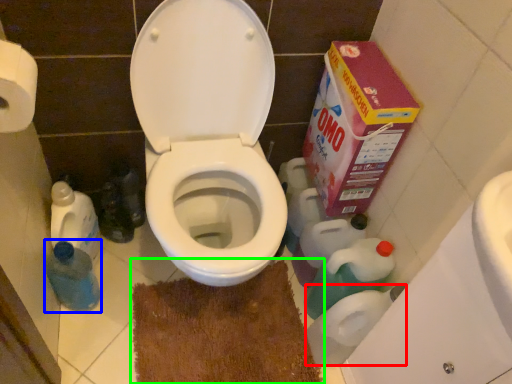
Question: Which is farther away from toilet paper (highlighted by a red box)? cleaning product (highlighted by a blue box) or bath mat (highlighted by a green box)?

Choices:
 (A) cleaning product
 (B) bath mat

Answer: (A)